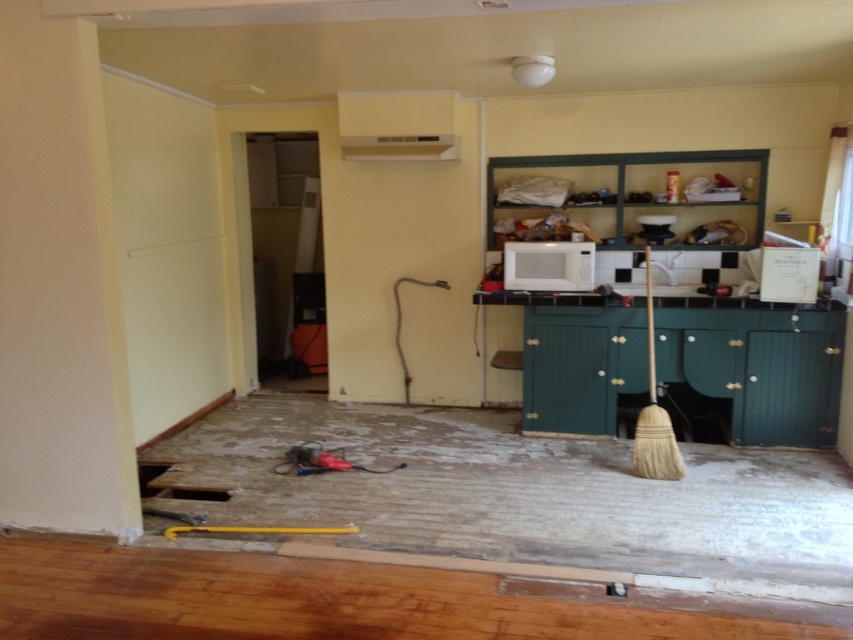
Question: Can you confirm if white matte microwave at center is bigger than white matte exhaust hood at upper center?

Choices:
 (A) yes
 (B) no

Answer: (A)

Question: Which point is closer to the camera taking this photo?

Choices:
 (A) (357, 156)
 (B) (589, 272)

Answer: (B)

Question: Among these objects, which one is farthest from the camera?

Choices:
 (A) white matte microwave at center
 (B) white matte exhaust hood at upper center

Answer: (B)

Question: Observing the image, what is the correct spatial positioning of white matte microwave at center in reference to white matte exhaust hood at upper center?

Choices:
 (A) right
 (B) left

Answer: (A)

Question: Does white matte microwave at center have a greater width compared to white matte exhaust hood at upper center?

Choices:
 (A) no
 (B) yes

Answer: (A)

Question: Which point appears farthest from the camera in this image?

Choices:
 (A) (576, 289)
 (B) (357, 138)

Answer: (B)